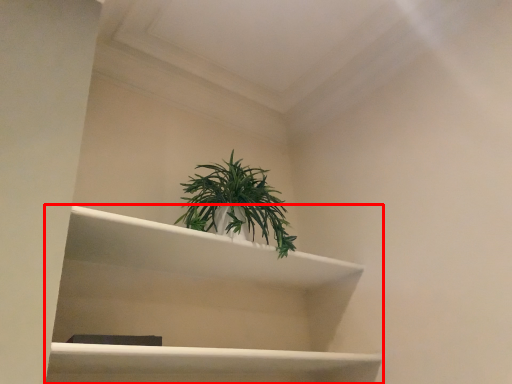
Question: Considering the relative positions of shelf (annotated by the red box) and houseplant in the image provided, where is shelf (annotated by the red box) located with respect to the staircase?

Choices:
 (A) right
 (B) left

Answer: (B)